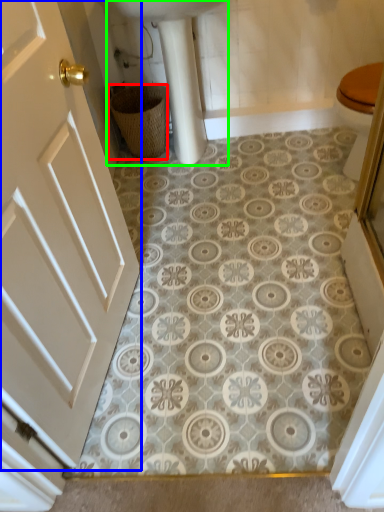
Question: Considering the real-world distances, which object is closest to basket (highlighted by a red box)? door (highlighted by a blue box) or sink (highlighted by a green box).

Choices:
 (A) door
 (B) sink

Answer: (B)